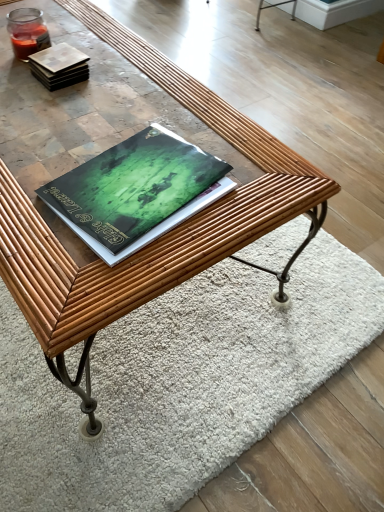
Find the location of a particular element. This screenshot has height=512, width=384. vacant area located to the right-hand side of matte brown tile at upper left, marked as the first book in a top-to-bottom arrangement is located at coordinates (135, 80).